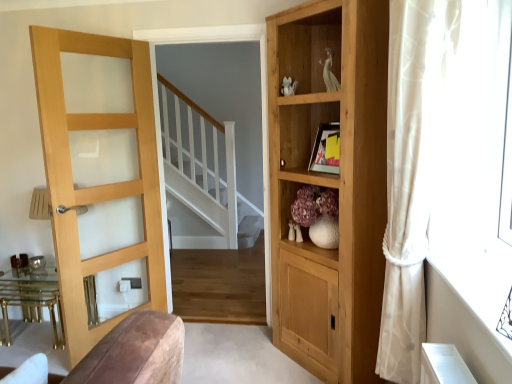
From the picture: In order to face light wood/glass door at left, should I rotate leftwards or rightwards?

Rotate your view left by about 19.022°.

At what (x,y) coordinates should I click in order to perform the action: click on light wood/glass door at left. Please return your answer as a coordinate pair (x, y). The image size is (512, 384). Looking at the image, I should click on (96, 186).

Find the location of `gold metallic table at left`. gold metallic table at left is located at coordinates (31, 297).

The height and width of the screenshot is (384, 512). What do you see at coordinates (412, 170) in the screenshot? I see `sheer white curtain at right` at bounding box center [412, 170].

Image resolution: width=512 pixels, height=384 pixels. Identify the location of white matte vase at center. (316, 216).

Can you tell me how much natural wood cupboard at right and light wood/glass door at left differ in facing direction?

74.4 degrees.

Is natural wood cupboard at right behind light wood/glass door at left?

No, it is not.

Consider the image. Considering the sizes of objects natural wood cupboard at right and light wood/glass door at left in the image provided, who is wider, natural wood cupboard at right or light wood/glass door at left?

Wider between the two is natural wood cupboard at right.

Based on the photo, is natural wood cupboard at right shorter than light wood/glass door at left?

Incorrect, the height of natural wood cupboard at right does not fall short of that of light wood/glass door at left.

Does natural wood cupboard at right have a larger size compared to gold metallic table at left?

Correct, natural wood cupboard at right is larger in size than gold metallic table at left.

Which object is wider, natural wood cupboard at right or gold metallic table at left?

With larger width is natural wood cupboard at right.

Does natural wood cupboard at right have a greater height compared to gold metallic table at left?

Yes, natural wood cupboard at right is taller than gold metallic table at left.

Is point (362, 87) less distant than point (62, 341)?

Yes.

The height and width of the screenshot is (384, 512). Identify the location of curtain on the right of gold metallic table at left. (412, 170).

Is sheer white curtain at right thinner than gold metallic table at left?

Yes, sheer white curtain at right is thinner than gold metallic table at left.

Who is smaller, sheer white curtain at right or gold metallic table at left?

gold metallic table at left.

Is gold metallic table at left bigger than white matte vase at center?

Indeed, gold metallic table at left has a larger size compared to white matte vase at center.

From the image's perspective, which is below, gold metallic table at left or white matte vase at center?

Answer: gold metallic table at left is shown below in the image.

Is gold metallic table at left shorter than white matte vase at center?

No, gold metallic table at left is not shorter than white matte vase at center.

Is gold metallic table at left thinner than white matte vase at center?

No, gold metallic table at left is not thinner than white matte vase at center.

Considering the relative sizes of white matte vase at center and light wood/glass door at left in the image provided, is white matte vase at center taller than light wood/glass door at left?

No, white matte vase at center is not taller than light wood/glass door at left.

Which object is positioned more to the left, white matte vase at center or light wood/glass door at left?

Positioned to the left is light wood/glass door at left.

I want to click on door that is on the left side of white matte vase at center, so click(96, 186).

From a real-world perspective, is white matte vase at center under light wood/glass door at left?

Yes, from a real-world perspective, white matte vase at center is under light wood/glass door at left.

Does gold metallic table at left have a lesser width compared to light wood/glass door at left?

No, gold metallic table at left is not thinner than light wood/glass door at left.

Is gold metallic table at left taller or shorter than light wood/glass door at left?

Clearly, gold metallic table at left is shorter compared to light wood/glass door at left.

Which object is positioned more to the right, gold metallic table at left or light wood/glass door at left?

light wood/glass door at left.

Is light wood/glass door at left positioned in front of sheer white curtain at right?

No, light wood/glass door at left is further to the viewer.

From the picture: Which of these two, light wood/glass door at left or sheer white curtain at right, is smaller?

With smaller size is sheer white curtain at right.

Is light wood/glass door at left aimed at sheer white curtain at right?

No, light wood/glass door at left is not turned towards sheer white curtain at right.

The image size is (512, 384). Find the location of `door that appears below the natural wood cupboard at right (from a real-world perspective)`. door that appears below the natural wood cupboard at right (from a real-world perspective) is located at coordinates (96, 186).

You are a GUI agent. You are given a task and a screenshot of the screen. Output one action in this format:
    pyautogui.click(x=<x>, y=<y>)
    Task: Click on the table that appears behind the natural wood cupboard at right
    This screenshot has width=512, height=384.
    Given the screenshot: What is the action you would take?
    pyautogui.click(x=31, y=297)

From the picture: Looking at the image, which one is located further to light wood/glass door at left, white matte vase at center or sheer white curtain at right?

sheer white curtain at right.

Based on their spatial positions, is light wood/glass door at left or natural wood cupboard at right closer to white matte vase at center?

natural wood cupboard at right lies closer to white matte vase at center than the other object.

Looking at the image, which one is located further to gold metallic table at left, sheer white curtain at right or natural wood cupboard at right?

sheer white curtain at right is positioned further to the anchor gold metallic table at left.

Which object lies nearer to the anchor point sheer white curtain at right, light wood/glass door at left or gold metallic table at left?

light wood/glass door at left is positioned closer to the anchor sheer white curtain at right.

When comparing their distances from light wood/glass door at left, does sheer white curtain at right or natural wood cupboard at right seem further?

sheer white curtain at right is positioned further to the anchor light wood/glass door at left.

Which object lies nearer to the anchor point natural wood cupboard at right, sheer white curtain at right or gold metallic table at left?

The object closer to natural wood cupboard at right is sheer white curtain at right.

When comparing their distances from gold metallic table at left, does natural wood cupboard at right or sheer white curtain at right seem closer?

natural wood cupboard at right is closer to gold metallic table at left.

Based on their spatial positions, is gold metallic table at left or white matte vase at center further from sheer white curtain at right?

The object further to sheer white curtain at right is gold metallic table at left.

Find the location of `cupboard between gold metallic table at left and sheer white curtain at right in the horizontal direction`. cupboard between gold metallic table at left and sheer white curtain at right in the horizontal direction is located at coordinates [x=330, y=185].

Find the location of a particular element. shelf situated between light wood/glass door at left and natural wood cupboard at right from left to right is located at coordinates (316, 216).

The height and width of the screenshot is (384, 512). I want to click on door between gold metallic table at left and natural wood cupboard at right in the horizontal direction, so click(x=96, y=186).

Locate an element on the screen. The width and height of the screenshot is (512, 384). cupboard between light wood/glass door at left and sheer white curtain at right in the horizontal direction is located at coordinates (330, 185).